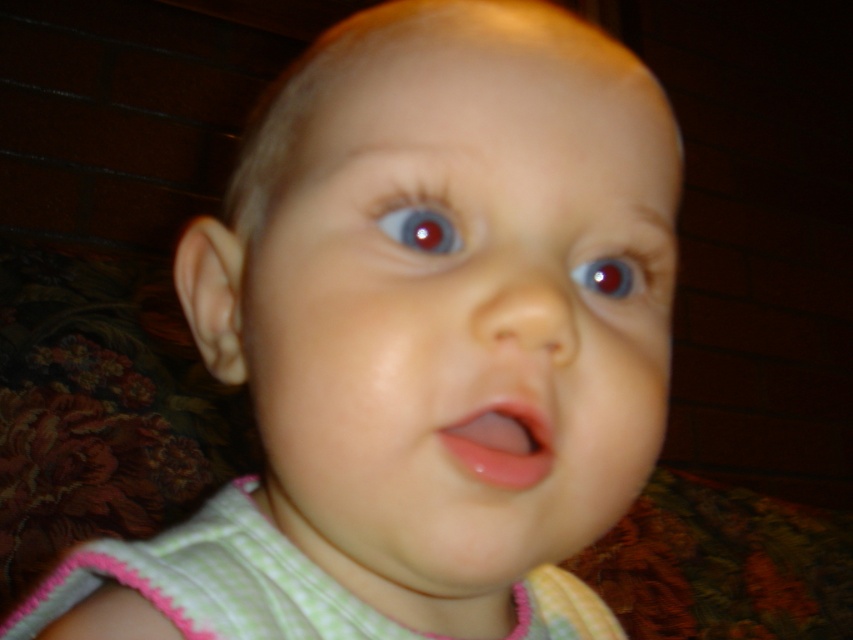
Based on the photo, between shiny blue eye at center and glossy red eye at upper center, which one appears on the right side from the viewer's perspective?

From the viewer's perspective, glossy red eye at upper center appears more on the right side.

Does point (437, 244) come behind point (624, 278)?

No, (437, 244) is in front of (624, 278).

You are a GUI agent. You are given a task and a screenshot of the screen. Output one action in this format:
    pyautogui.click(x=<x>, y=<y>)
    Task: Click on the shiny blue eye at center
    The image size is (853, 640).
    Given the screenshot: What is the action you would take?
    pyautogui.click(x=421, y=228)

Between smooth skin baby at center and shiny blue eye at center, which one has more height?

With more height is smooth skin baby at center.

Does point (412, 291) come closer to viewer compared to point (399, 212)?

Yes, point (412, 291) is in front of point (399, 212).

Locate an element on the screen. smooth skin baby at center is located at coordinates (461, 320).

Between point (486, 412) and point (583, 275), which one is positioned in front?

Point (486, 412) is more forward.

Locate an element on the screen. The image size is (853, 640). pink glossy lips at center is located at coordinates (502, 444).

Identify the location of pink glossy lips at center. The image size is (853, 640). (502, 444).